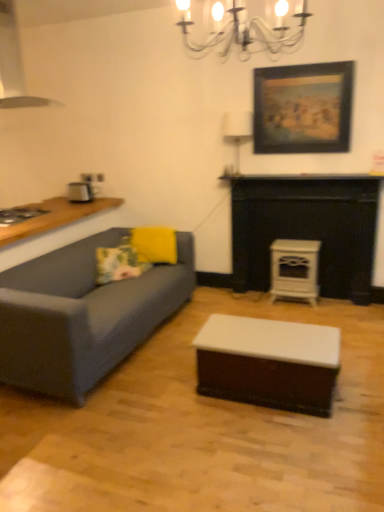
Question: Can white glossy fireplace at center be found inside metallic silver exhaust hood at upper left?

Choices:
 (A) yes
 (B) no

Answer: (B)

Question: Is white glossy fireplace at center at the back of metallic silver exhaust hood at upper left?

Choices:
 (A) no
 (B) yes

Answer: (A)

Question: Is metallic silver exhaust hood at upper left positioned in front of white glossy fireplace at center?

Choices:
 (A) no
 (B) yes

Answer: (B)

Question: Can you confirm if metallic silver exhaust hood at upper left is positioned to the right of white glossy fireplace at center?

Choices:
 (A) yes
 (B) no

Answer: (B)

Question: Is metallic silver exhaust hood at upper left shorter than white glossy fireplace at center?

Choices:
 (A) no
 (B) yes

Answer: (B)

Question: Is wooden framed painting at upper right spatially inside floral fabric pillow at left, the 1th pillow in the left-to-right sequence, or outside of it?

Choices:
 (A) inside
 (B) outside

Answer: (B)

Question: In terms of width, does wooden framed painting at upper right look wider or thinner when compared to floral fabric pillow at left, which is counted as the 2th pillow, starting from the right?

Choices:
 (A) thin
 (B) wide

Answer: (A)

Question: Is point (266, 84) closer or farther from the camera than point (97, 282)?

Choices:
 (A) closer
 (B) farther

Answer: (B)

Question: From the image's perspective, is wooden framed painting at upper right above or below floral fabric pillow at left, which is counted as the 2th pillow, starting from the right?

Choices:
 (A) below
 (B) above

Answer: (B)

Question: In the image, is floral fabric pillow at left, which is counted as the 2th pillow, starting from the right, on the left side or the right side of yellow matte pillow at center, the second pillow viewed from the left?

Choices:
 (A) right
 (B) left

Answer: (B)

Question: From a real-world perspective, is floral fabric pillow at left, the 1th pillow in the left-to-right sequence, physically located above or below yellow matte pillow at center, the second pillow viewed from the left?

Choices:
 (A) below
 (B) above

Answer: (A)

Question: Is point (127, 260) closer or farther from the camera than point (168, 234)?

Choices:
 (A) closer
 (B) farther

Answer: (A)

Question: Is floral fabric pillow at left, which is counted as the 2th pillow, starting from the right, bigger or smaller than yellow matte pillow at center, the second pillow viewed from the left?

Choices:
 (A) small
 (B) big

Answer: (A)

Question: From the image's perspective, is white glossy coffee table at center positioned above or below floral fabric pillow at left, the 1th pillow in the left-to-right sequence?

Choices:
 (A) above
 (B) below

Answer: (B)

Question: Considering their positions, is white glossy coffee table at center located in front of or behind floral fabric pillow at left, the 1th pillow in the left-to-right sequence?

Choices:
 (A) behind
 (B) front

Answer: (B)